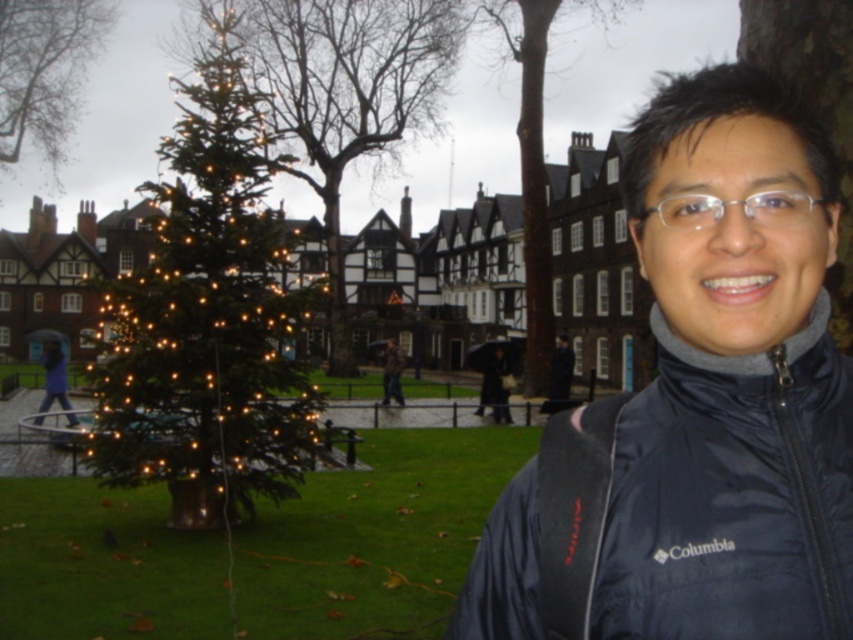
You are a photographer trying to capture both the green matte christmas tree at left and the green matte christmas tree at center in a single shot. Which tree should you position closer to the camera to ensure both are fully visible without one blocking the other?

You should position the green matte christmas tree at left closer to the camera since the green matte christmas tree at center is behind it, allowing both trees to be visible without obstruction.

You are a landscape architect designing a path between the green textured christmas tree at left and the brown textured tree at center. The path must be straight and 10 feet wide. Is there enough space between the two trees to accommodate this path?

The distance between the green textured christmas tree at left and the brown textured tree at center is 80.96 feet. Since the path only requires 10 feet of width, there is ample space to create a straight, 10 feet wide path between them.